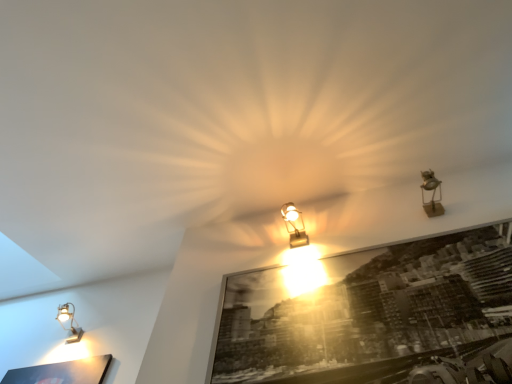
Question: Is matte silver lamp at lower left, arranged as the third lamp when viewed from the right, at the right side of black glossy picture frame at center?

Choices:
 (A) yes
 (B) no

Answer: (B)

Question: Is matte silver lamp at lower left, which is the 1th lamp in bottom-to-top order, aimed at black glossy picture frame at center?

Choices:
 (A) yes
 (B) no

Answer: (B)

Question: Is matte silver lamp at lower left, which is counted as the 3th lamp, starting from the top, turned away from black glossy picture frame at center?

Choices:
 (A) yes
 (B) no

Answer: (B)

Question: Is the position of matte silver lamp at lower left, arranged as the 1th lamp when viewed from the left, more distant than that of black glossy picture frame at center?

Choices:
 (A) no
 (B) yes

Answer: (B)

Question: Does matte silver lamp at lower left, which is counted as the 3th lamp, starting from the top, have a greater width compared to black glossy picture frame at center?

Choices:
 (A) no
 (B) yes

Answer: (B)

Question: From the image's perspective, is matte silver lamp at lower left, which is the 1th lamp in bottom-to-top order, under black glossy picture frame at center?

Choices:
 (A) no
 (B) yes

Answer: (B)

Question: From the image's perspective, is metallic gold spotlight at upper right, marked as the third lamp in a left-to-right arrangement, below matte silver lamp at lower left, arranged as the third lamp when viewed from the right?

Choices:
 (A) yes
 (B) no

Answer: (B)

Question: Is metallic gold spotlight at upper right, the 3th lamp positioned from the back, oriented away from matte silver lamp at lower left, which is the 1th lamp in bottom-to-top order?

Choices:
 (A) no
 (B) yes

Answer: (A)

Question: Is metallic gold spotlight at upper right, the 1th lamp from the top, behind matte silver lamp at lower left, which is counted as the 3th lamp, starting from the top?

Choices:
 (A) no
 (B) yes

Answer: (A)

Question: Considering the relative positions of metallic gold spotlight at upper right, the first lamp when ordered from right to left, and matte silver lamp at lower left, arranged as the 1th lamp when viewed from the back, in the image provided, is metallic gold spotlight at upper right, the first lamp when ordered from right to left, to the right of matte silver lamp at lower left, arranged as the 1th lamp when viewed from the back, from the viewer's perspective?

Choices:
 (A) no
 (B) yes

Answer: (B)

Question: From the image's perspective, would you say metallic gold spotlight at upper right, the 3th lamp positioned from the back, is positioned over matte silver lamp at lower left, arranged as the 1th lamp when viewed from the back?

Choices:
 (A) yes
 (B) no

Answer: (A)

Question: Does metallic gold spotlight at upper right, marked as the third lamp in a left-to-right arrangement, have a smaller size compared to matte silver lamp at lower left, which is counted as the 3th lamp, starting from the top?

Choices:
 (A) no
 (B) yes

Answer: (B)

Question: Is matte silver lamp at lower left, which is the 1th lamp in bottom-to-top order, wider than metallic gold spotlight at upper right, the 1th lamp from the top?

Choices:
 (A) no
 (B) yes

Answer: (B)